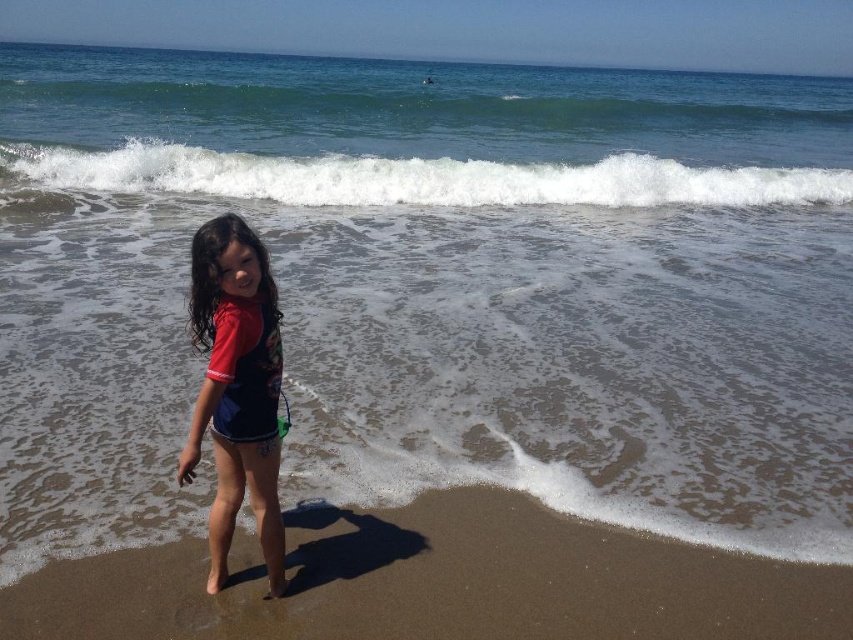
Question: Which object is the farthest from the green smooth wave at upper center?

Choices:
 (A) white frothy wave at upper center
 (B) brown sandy beach at lower center

Answer: (B)

Question: Which point is farther to the camera?

Choices:
 (A) click(x=833, y=170)
 (B) click(x=733, y=600)
 (C) click(x=396, y=125)

Answer: (C)

Question: Among these objects, which one is farthest from the camera?

Choices:
 (A) matte red swimsuit at center
 (B) brown sandy beach at lower center
 (C) white frothy wave at upper center
 (D) green smooth wave at upper center

Answer: (D)

Question: Is brown sandy beach at lower center to the left of white frothy wave at upper center from the viewer's perspective?

Choices:
 (A) no
 (B) yes

Answer: (B)

Question: Does brown sandy beach at lower center appear on the right side of matte red swimsuit at center?

Choices:
 (A) yes
 (B) no

Answer: (A)

Question: Is brown sandy beach at lower center thinner than white frothy wave at upper center?

Choices:
 (A) no
 (B) yes

Answer: (B)